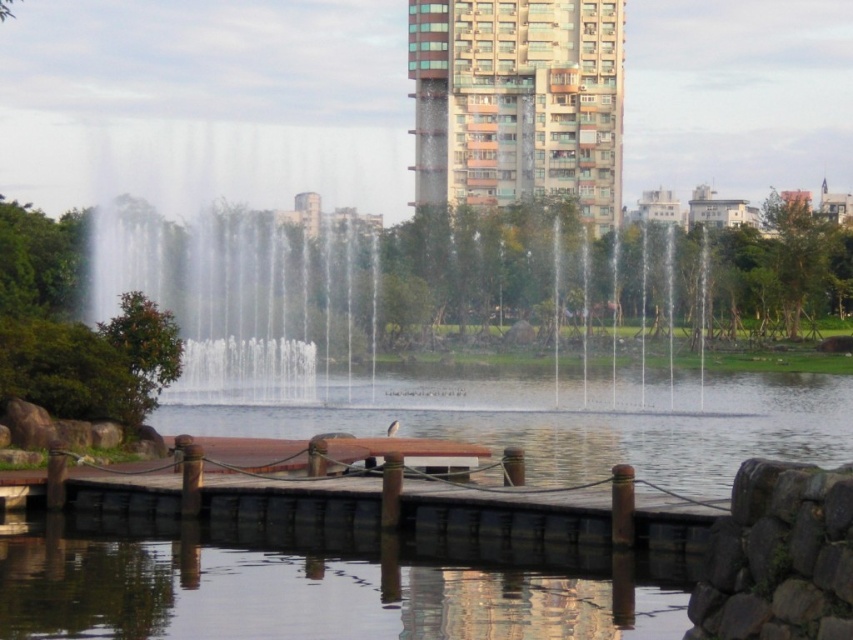
Question: Which of the following is the farthest from the observer?

Choices:
 (A) (624, 419)
 (B) (328, 193)
 (C) (332, 474)

Answer: (B)

Question: Is brown wooden dock at center below white water at center?

Choices:
 (A) no
 (B) yes

Answer: (B)

Question: Does transparent glass pond at center have a greater width compared to brown wooden picnic table at center?

Choices:
 (A) no
 (B) yes

Answer: (B)

Question: Among these objects, which one is farthest from the camera?

Choices:
 (A) brown wooden picnic table at center
 (B) transparent glass pond at center
 (C) transparent water at dock center
 (D) brown wooden dock at center

Answer: (C)

Question: Considering the real-world distances, which object is farthest from the transparent glass pond at center?

Choices:
 (A) brown wooden dock at center
 (B) brown wooden picnic table at center

Answer: (B)

Question: Can you confirm if transparent water at dock center is positioned below brown wooden dock at center?

Choices:
 (A) no
 (B) yes

Answer: (A)